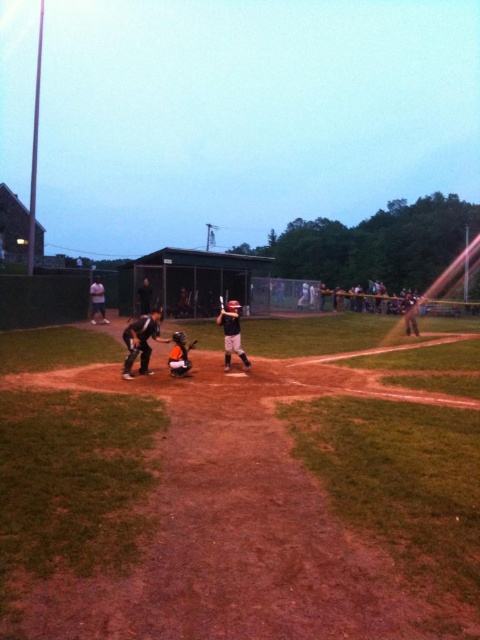
Question: Estimate the real-world distances between objects in this image. Which object is closer to the orange matte catcher at center?

Choices:
 (A) matte black bat at center
 (B) orange jersey at center
 (C) light blue shirt at center

Answer: (A)

Question: Does orange matte catcher at center lie in front of brown leather glove at center?

Choices:
 (A) yes
 (B) no

Answer: (A)

Question: Considering the relative positions of matte black bat at center and orange matte catcher at center in the image provided, where is matte black bat at center located with respect to orange matte catcher at center?

Choices:
 (A) left
 (B) right

Answer: (B)

Question: Among these objects, which one is farthest from the camera?

Choices:
 (A) matte black bat at center
 (B) light blue shirt at center

Answer: (B)

Question: Which of the following is the closest to the observer?

Choices:
 (A) matte black catcher at center
 (B) orange jersey at center

Answer: (A)

Question: Is matte black bat at center bigger than orange jersey at center?

Choices:
 (A) no
 (B) yes

Answer: (A)